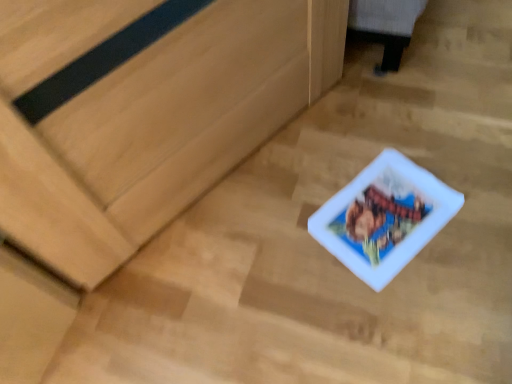
Identify the location of white glossy comic book at center. (385, 216).

The height and width of the screenshot is (384, 512). Describe the element at coordinates (385, 216) in the screenshot. I see `white glossy comic book at center` at that location.

The image size is (512, 384). Find the location of `white glossy comic book at center`. white glossy comic book at center is located at coordinates (385, 216).